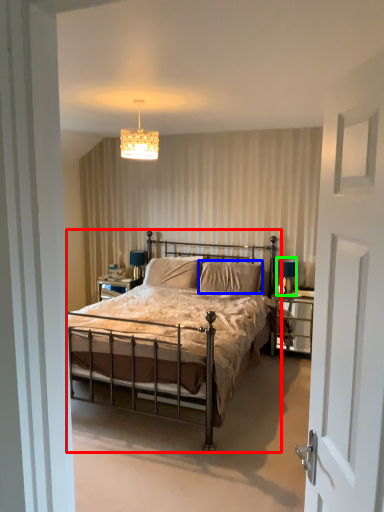
Question: Based on their relative distances, which object is farther from bed (highlighted by a red box)? Choose from pillow (highlighted by a blue box) and table lamp (highlighted by a green box).

Choices:
 (A) pillow
 (B) table lamp

Answer: (B)